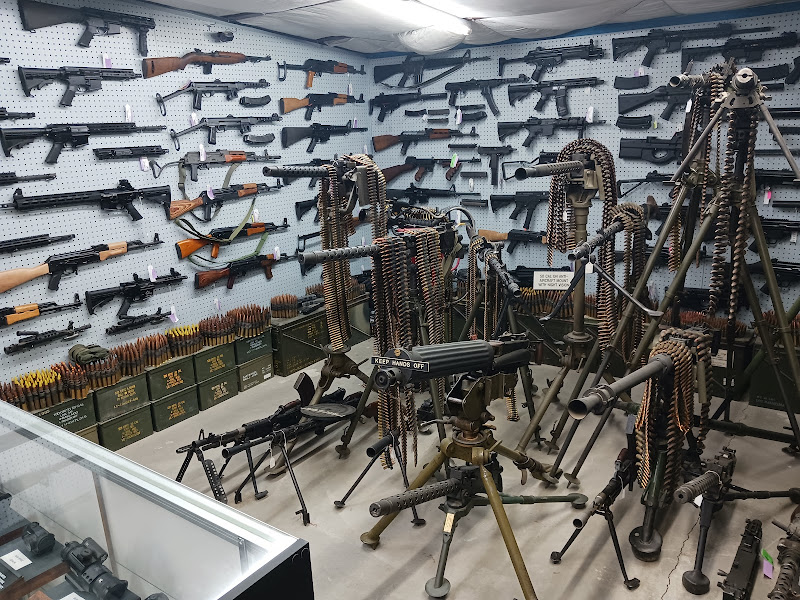
In order to click on peg hole wall in this screenshot , I will do `click(542, 189)`.